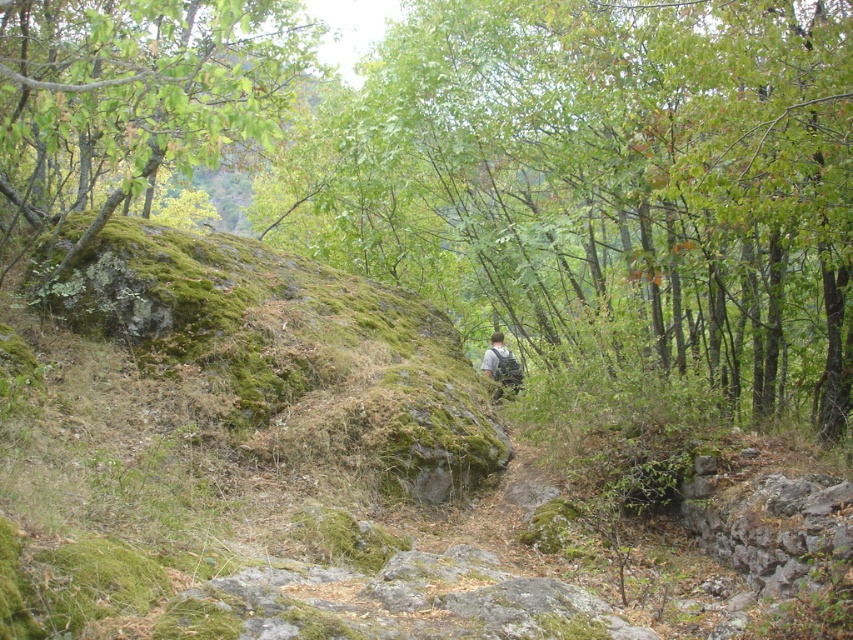
You are a hiker navigating a forest path and see the green mossy rock at center. If you were to draw a straight line from your current position to the rock, what would be the coordinates of the rock in the image?

The 2D location of the green mossy rock at center is at point (x=604, y=180), so the coordinates would be 0.284 and 0.709.

You are a hiker navigating a forest path and see two green mossy rocks. One is at the center and the other is at the upper left. Which direction should you turn to reach the green mossy rock at center from the green mossy rock at upper left?

To reach the green mossy rock at center from the green mossy rock at upper left, you should turn to the right, as the green mossy rock at center is positioned to the right of the green mossy rock at upper left.